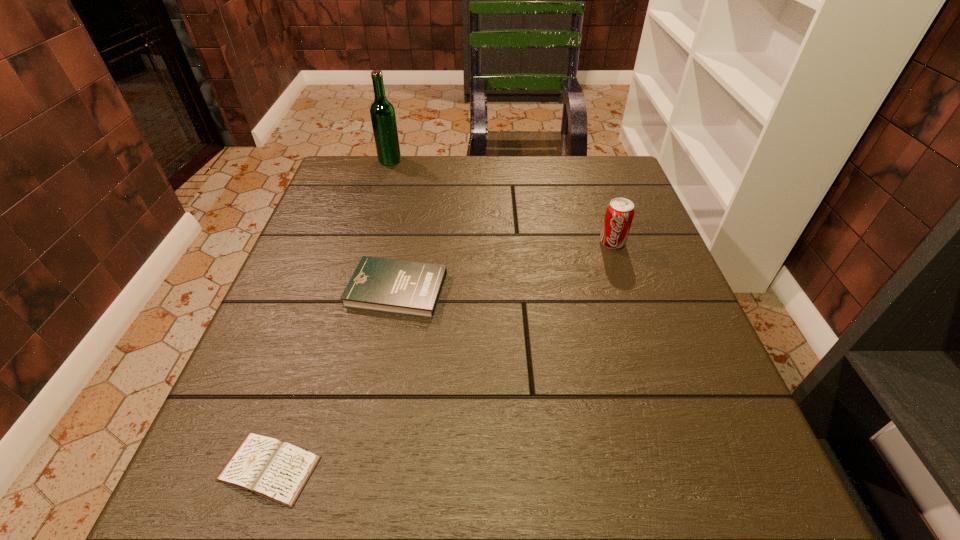
Identify the location of free point between the second nearest object and the soda can. (505, 266).

This screenshot has width=960, height=540. I want to click on free space between the third shortest object and the book, so click(x=505, y=266).

This screenshot has height=540, width=960. I want to click on empty location between the farthest object and the soda can, so click(x=501, y=201).

You are a GUI agent. You are given a task and a screenshot of the screen. Output one action in this format:
    pyautogui.click(x=<x>, y=<y>)
    Task: Click on the vacant area that lies between the farthest object and the shortest object
    
    Given the screenshot: What is the action you would take?
    pyautogui.click(x=329, y=314)

Image resolution: width=960 pixels, height=540 pixels. I want to click on vacant area that lies between the diary and the tallest object, so click(x=329, y=314).

Where is `vacant space in between the second nearest object and the shortest object`? The width and height of the screenshot is (960, 540). vacant space in between the second nearest object and the shortest object is located at coordinates (333, 379).

This screenshot has width=960, height=540. What are the coordinates of `object that is the second closest to the diary` in the screenshot? It's located at (619, 214).

Identify the location of the third closest object to the nearest object. The height and width of the screenshot is (540, 960). (382, 113).

Image resolution: width=960 pixels, height=540 pixels. I want to click on vacant space that satisfies the following two spatial constraints: 1. on the front side of the tallest object; 2. on the right side of the second farthest object, so click(366, 242).

Where is `free space that satisfies the following two spatial constraints: 1. on the back side of the diary; 2. on the right side of the soda can`? This screenshot has height=540, width=960. free space that satisfies the following two spatial constraints: 1. on the back side of the diary; 2. on the right side of the soda can is located at coordinates (347, 242).